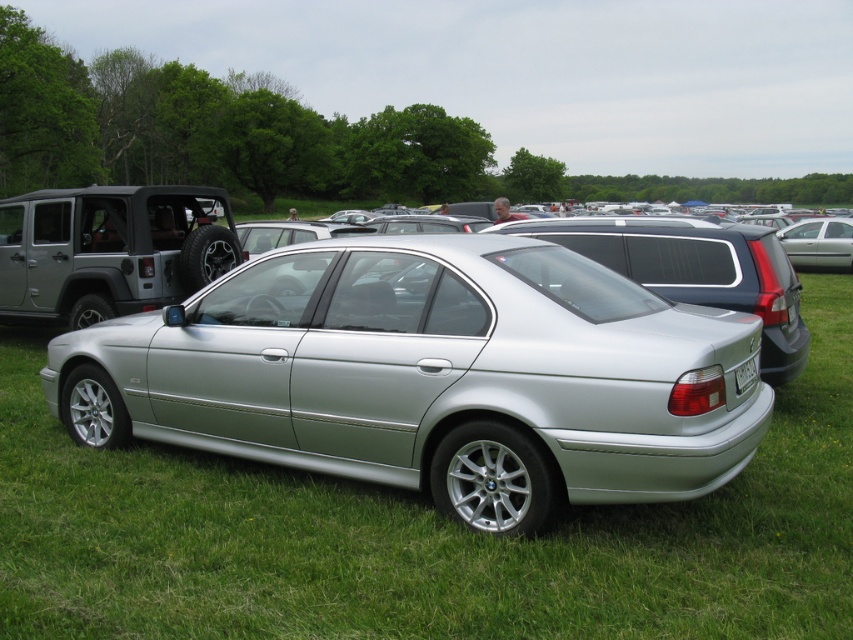
Question: Is satin silver sedan at center in front of white plastic license plate at rear?

Choices:
 (A) yes
 (B) no

Answer: (B)

Question: Based on their relative distances, which object is nearer to the satin silver sedan at center?

Choices:
 (A) silver metallic sedan at center
 (B) matte silver suv at left
 (C) white plastic license plate at rear

Answer: (B)

Question: Which object is the closest to the silver metallic sedan at center?

Choices:
 (A) white plastic license plate at rear
 (B) satin silver sedan at center

Answer: (A)

Question: Estimate the real-world distances between objects in this image. Which object is farther from the matte silver suv at left?

Choices:
 (A) satin silver sedan at center
 (B) white plastic license plate at rear

Answer: (A)

Question: Is satin silver sedan at center to the right of white plastic license plate at rear from the viewer's perspective?

Choices:
 (A) yes
 (B) no

Answer: (A)

Question: Is silver metallic sedan at center to the left of matte silver suv at left from the viewer's perspective?

Choices:
 (A) yes
 (B) no

Answer: (B)